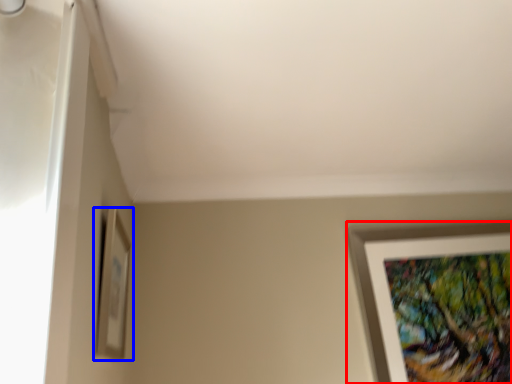
Question: Which of the following is the farthest to the observer, picture frame (highlighted by a red box) or picture frame (highlighted by a blue box)?

Choices:
 (A) picture frame
 (B) picture frame

Answer: (A)